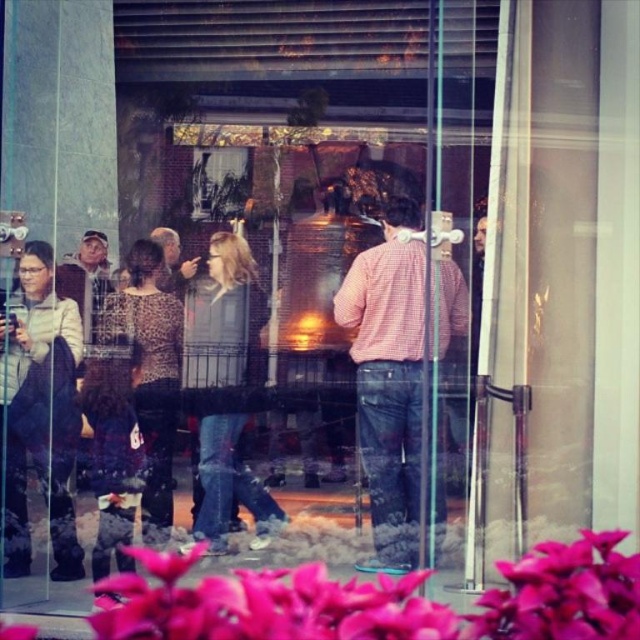
Question: Among these points, which one is farthest from the camera?

Choices:
 (A) (131, 589)
 (B) (28, 269)
 (C) (356, 394)

Answer: (C)

Question: Is pink matte leaves at lower center below matte black jacket at left?

Choices:
 (A) no
 (B) yes

Answer: (B)

Question: Does matte gray jacket at left appear over matte black jacket at left?

Choices:
 (A) no
 (B) yes

Answer: (A)

Question: Considering the real-world distances, which object is closest to the pink matte leaves at lower center?

Choices:
 (A) matte gray jacket at left
 (B) pink checkered shirt at center

Answer: (B)

Question: In this image, where is pink checkered shirt at center located relative to matte gray jacket at left?

Choices:
 (A) below
 (B) above

Answer: (B)

Question: Which point is closer to the camera?

Choices:
 (A) (83, 304)
 (B) (28, 330)

Answer: (B)